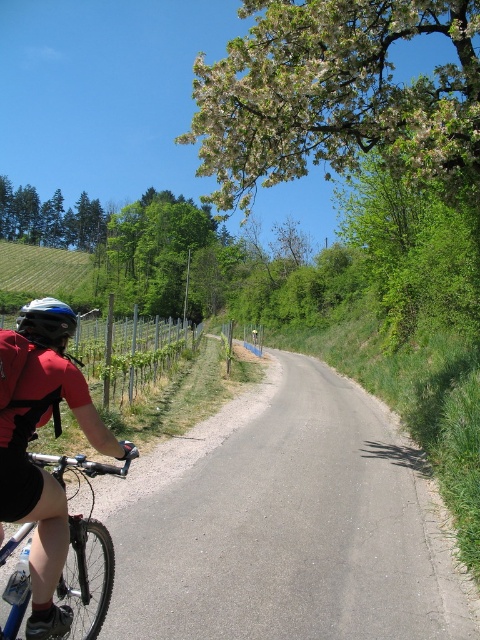
Question: Can you confirm if blue matte bicycle at lower left is bigger than matte black helmet at left?

Choices:
 (A) yes
 (B) no

Answer: (B)

Question: Can you confirm if blue matte bicycle at lower left is positioned below matte black helmet at left?

Choices:
 (A) yes
 (B) no

Answer: (A)

Question: From the image, what is the correct spatial relationship of blue matte bicycle at lower left in relation to matte black helmet at left?

Choices:
 (A) below
 (B) above

Answer: (A)

Question: Among these objects, which one is farthest from the camera?

Choices:
 (A) matte black helmet at left
 (B) blue matte bicycle at lower left

Answer: (A)

Question: Among these points, which one is farthest from the camera?

Choices:
 (A) (57, 333)
 (B) (20, 625)

Answer: (A)